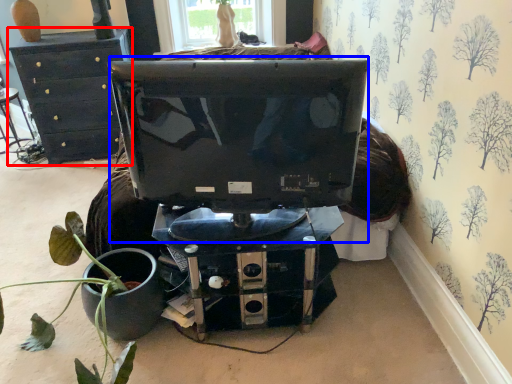
Question: Which point is closer to the camera, furniture (highlighted by a red box) or computer monitor (highlighted by a blue box)?

Choices:
 (A) furniture
 (B) computer monitor

Answer: (B)